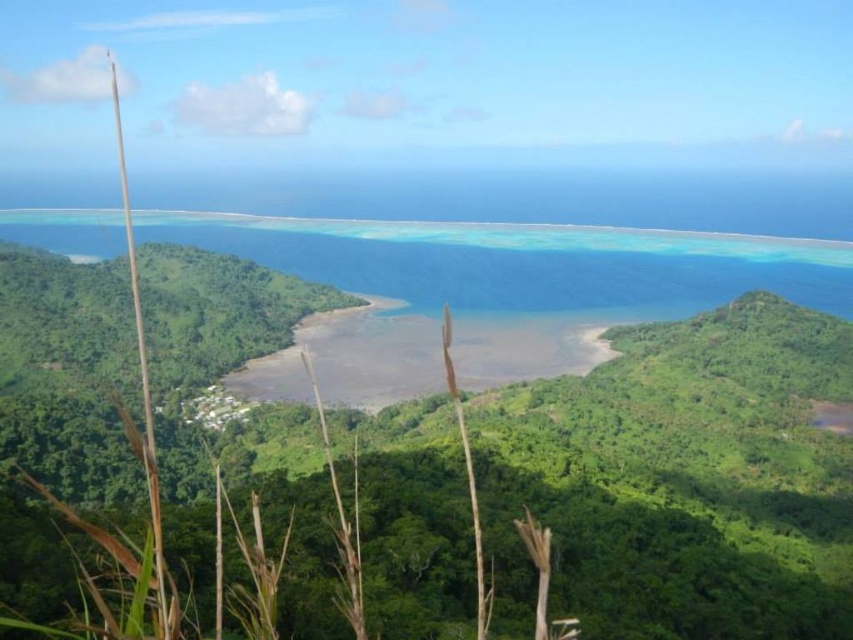
Question: Which point is closer to the camera?

Choices:
 (A) click(x=422, y=296)
 (B) click(x=694, y=538)

Answer: (B)

Question: From the image, what is the correct spatial relationship of green leafy vegetation at center in relation to clear blue water at center?

Choices:
 (A) right
 (B) left

Answer: (A)

Question: Considering the relative positions of green leafy vegetation at center and clear blue water at center in the image provided, where is green leafy vegetation at center located with respect to clear blue water at center?

Choices:
 (A) above
 (B) below

Answer: (B)

Question: Can you confirm if green leafy vegetation at center is wider than clear blue water at center?

Choices:
 (A) no
 (B) yes

Answer: (A)